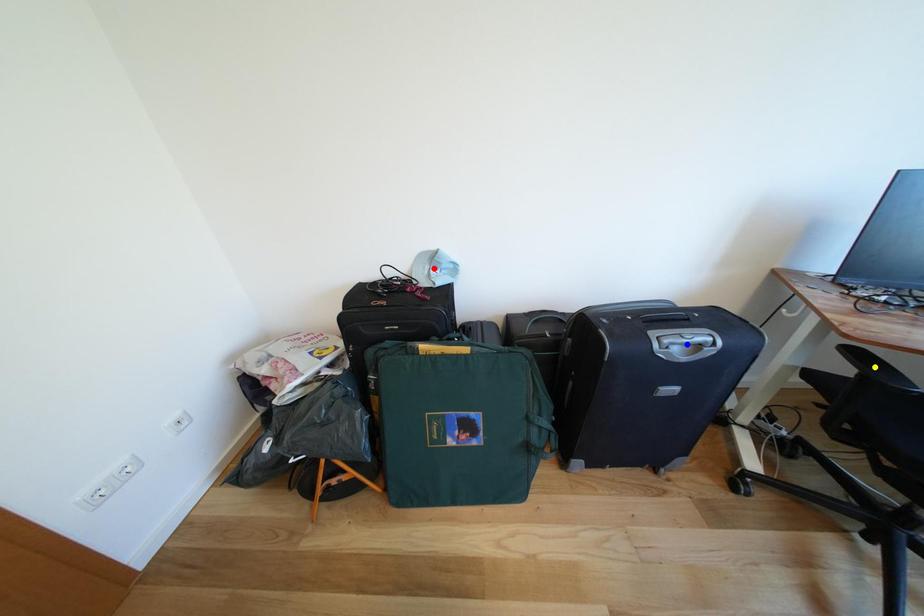
Order these from farthest to nearest:
yellow point, blue point, red point

red point, blue point, yellow point